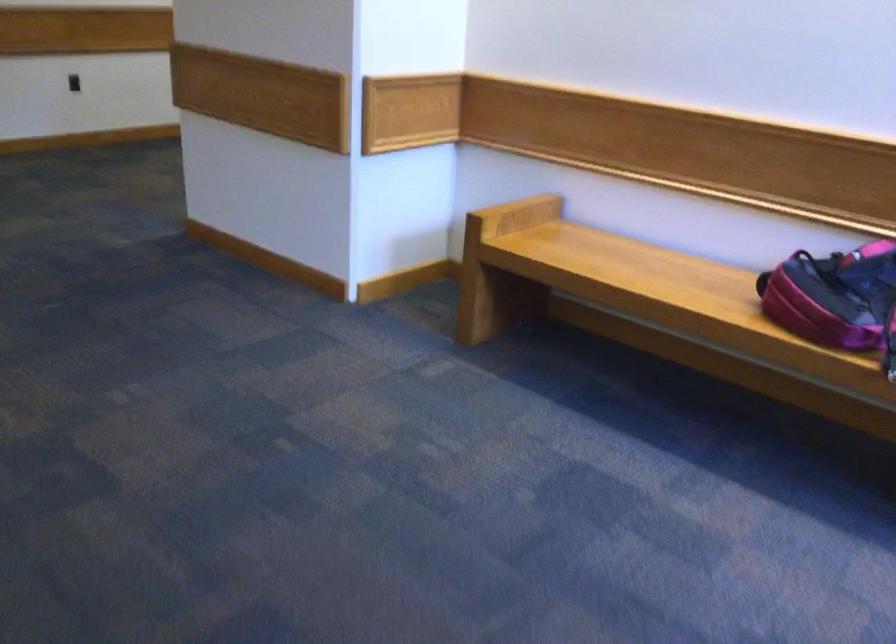
Where is `bench sitting surface`? bench sitting surface is located at coordinates pyautogui.click(x=633, y=270).